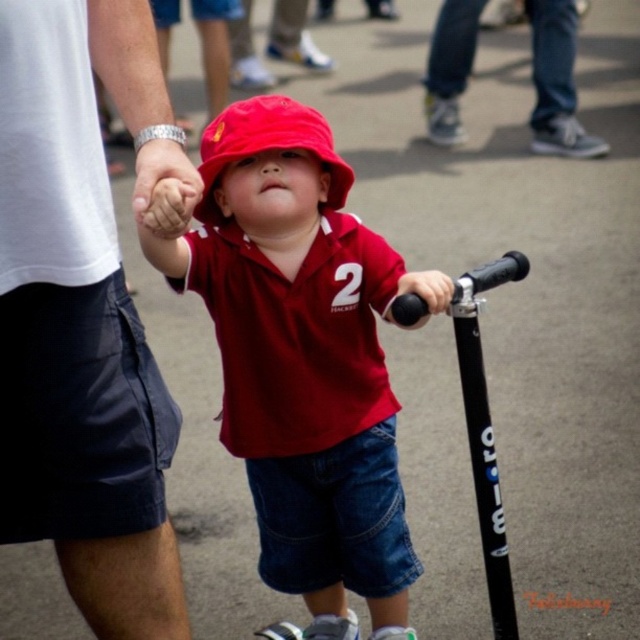
You are a photographer trying to capture a photo of the child and the scooter. Since the matte red shirt at center and the black rubber handlebar at center are both in the frame, which one is positioned to the left?

The matte red shirt at center is positioned to the left of the black rubber handlebar at center according to the description.

You are a photographer trying to capture a photo of the child and the adult. You notice two points in the image labeled as point (320, 337) and point (440, 276). Based on their positions, which point is closer to the camera?

Point (440, 276) is closer to the camera because it is in front of point (320, 337).